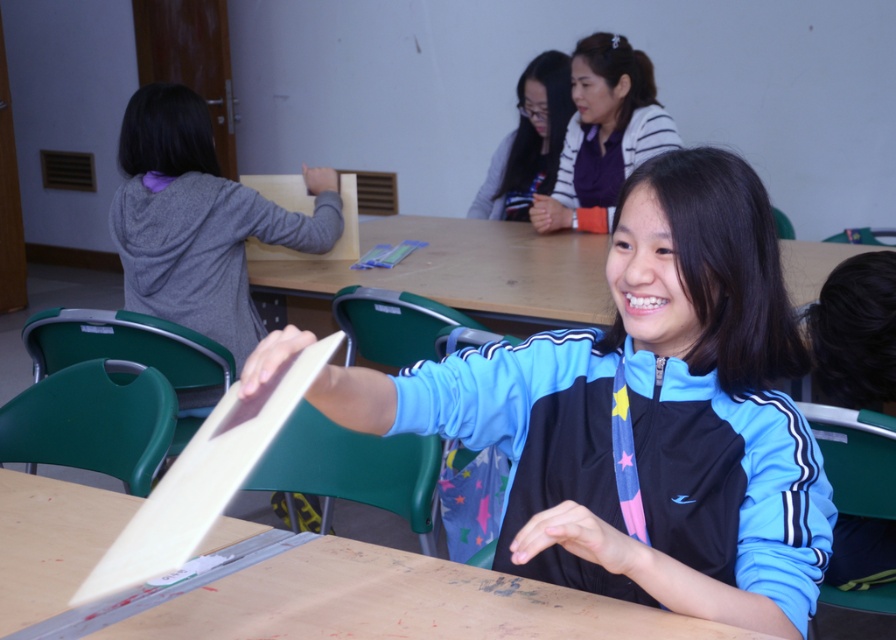
Based on the photo, can you confirm if matte purple sweater at upper center is positioned above matte black jacket at upper center?

Incorrect, matte purple sweater at upper center is not positioned above matte black jacket at upper center.

Does matte purple sweater at upper center appear on the right side of matte black jacket at upper center?

Yes, matte purple sweater at upper center is to the right of matte black jacket at upper center.

The height and width of the screenshot is (640, 896). What do you see at coordinates (602, 134) in the screenshot?
I see `matte purple sweater at upper center` at bounding box center [602, 134].

The width and height of the screenshot is (896, 640). I want to click on matte purple sweater at upper center, so [602, 134].

Is blue track jacket at center thinner than matte black jacket at upper center?

Incorrect, blue track jacket at center's width is not less than matte black jacket at upper center's.

Between blue track jacket at center and matte black jacket at upper center, which one is positioned higher?

matte black jacket at upper center is higher up.

Locate an element on the screen. This screenshot has width=896, height=640. blue track jacket at center is located at coordinates (647, 413).

Does wooden table at center appear under matte purple sweater at upper center?

Correct, wooden table at center is located below matte purple sweater at upper center.

Looking at this image, does wooden table at center have a lesser width compared to matte purple sweater at upper center?

No, wooden table at center is not thinner than matte purple sweater at upper center.

Is point (190, 602) positioned behind point (633, 112)?

No.

This screenshot has height=640, width=896. Find the location of `wooden table at center`. wooden table at center is located at coordinates (395, 602).